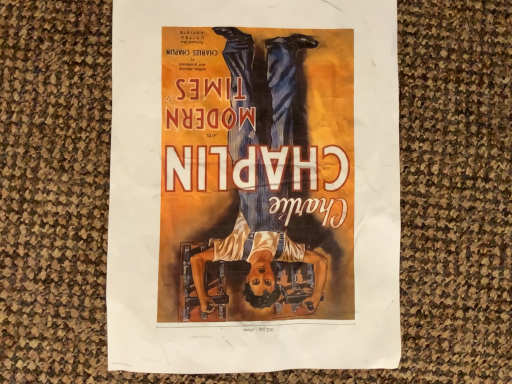
Image resolution: width=512 pixels, height=384 pixels. What do you see at coordinates (253, 186) in the screenshot? I see `matte paper poster at center` at bounding box center [253, 186].

Locate an element on the screen. matte paper poster at center is located at coordinates (253, 186).

The image size is (512, 384). Find the location of `matte paper poster at center`. matte paper poster at center is located at coordinates (253, 186).